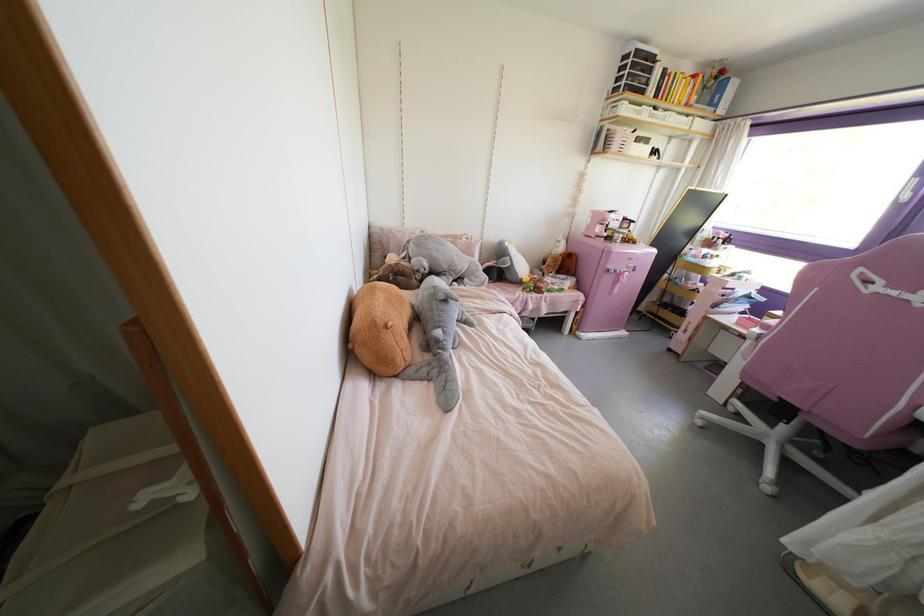
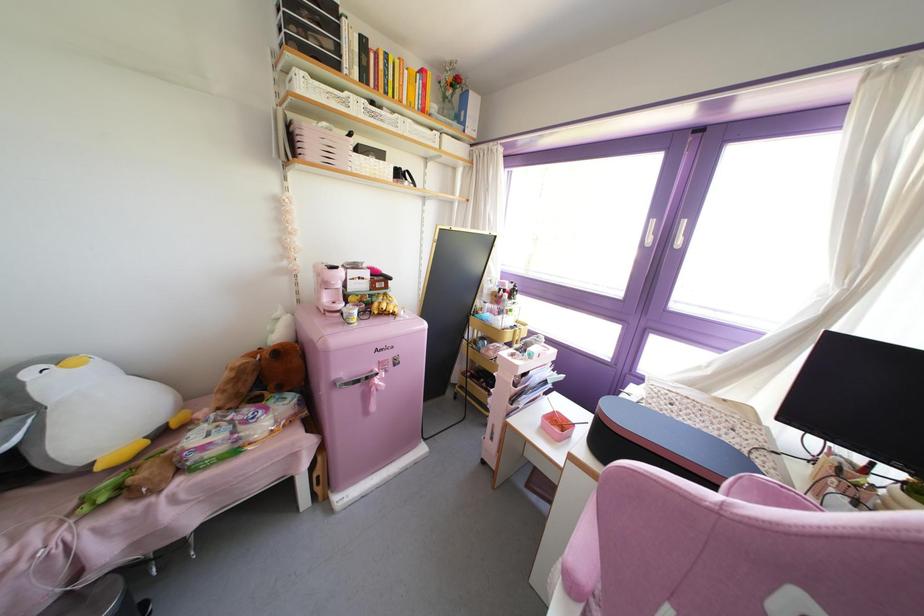
Locate, in the second image, the point that corresponds to the point at 614,145 in the first image.

(310, 148)